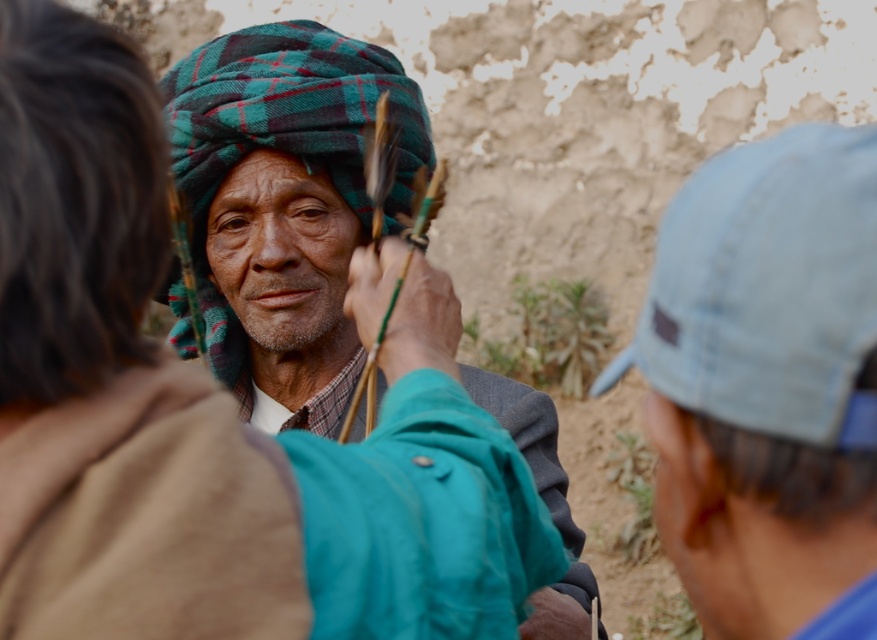
Question: Which object is farther from the camera taking this photo?

Choices:
 (A) light blue fabric cap at right
 (B) plaid wool turban at center

Answer: (B)

Question: Which point is farther to the camera?

Choices:
 (A) (408, 131)
 (B) (241, 307)
 (C) (826, 604)

Answer: (A)

Question: Can you confirm if light blue fabric cap at right is bigger than green plaid turban at center?

Choices:
 (A) no
 (B) yes

Answer: (B)

Question: Is plaid wool turban at center positioned at the back of green plaid turban at center?

Choices:
 (A) no
 (B) yes

Answer: (A)

Question: Does light blue fabric cap at right have a greater width compared to green plaid turban at center?

Choices:
 (A) no
 (B) yes

Answer: (B)

Question: Which object is closer to the camera taking this photo?

Choices:
 (A) light blue fabric cap at right
 (B) green plaid turban at center
 (C) plaid wool turban at center

Answer: (A)